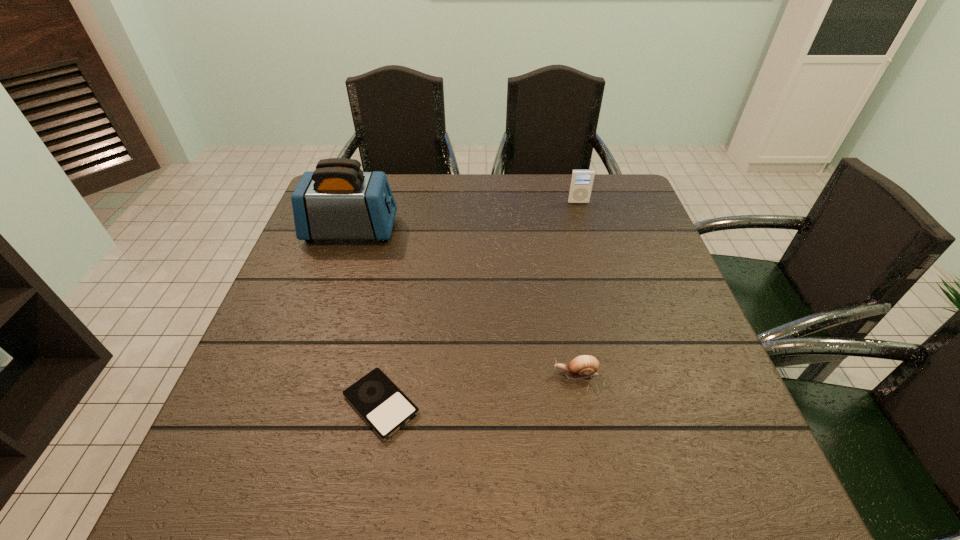
At what (x,y) coordinates should I click in order to perform the action: click on vacant space located 0.200m on the front-facing side of the third object from left to right. Please return your answer as a coordinate pair (x, y). Looking at the image, I should click on (455, 374).

Image resolution: width=960 pixels, height=540 pixels. I want to click on vacant space located on the front-facing side of the third object from left to right, so click(x=469, y=374).

Locate an element on the screen. This screenshot has height=540, width=960. vacant space located 0.080m on the front-facing side of the third object from left to right is located at coordinates point(514,374).

You are a GUI agent. You are given a task and a screenshot of the screen. Output one action in this format:
    pyautogui.click(x=<x>, y=<y>)
    Task: Click on the vacant area situated on the left of the nearer iPod
    
    Given the screenshot: What is the action you would take?
    pyautogui.click(x=316, y=404)

Where is `toaster located in the far edge section of the desktop`? toaster located in the far edge section of the desktop is located at coordinates (338, 201).

At what (x,y) coordinates should I click in order to perform the action: click on iPod at the far edge. Please return your answer as a coordinate pair (x, y). This screenshot has width=960, height=540. Looking at the image, I should click on (581, 183).

The height and width of the screenshot is (540, 960). Identify the location of object that is at the left edge. (338, 201).

What are the coordinates of `object that is at the right edge` in the screenshot? It's located at (581, 183).

Where is `object that is at the far left corner`? object that is at the far left corner is located at coordinates (338, 201).

Where is `object present at the far right corner`? The height and width of the screenshot is (540, 960). object present at the far right corner is located at coordinates (581, 183).